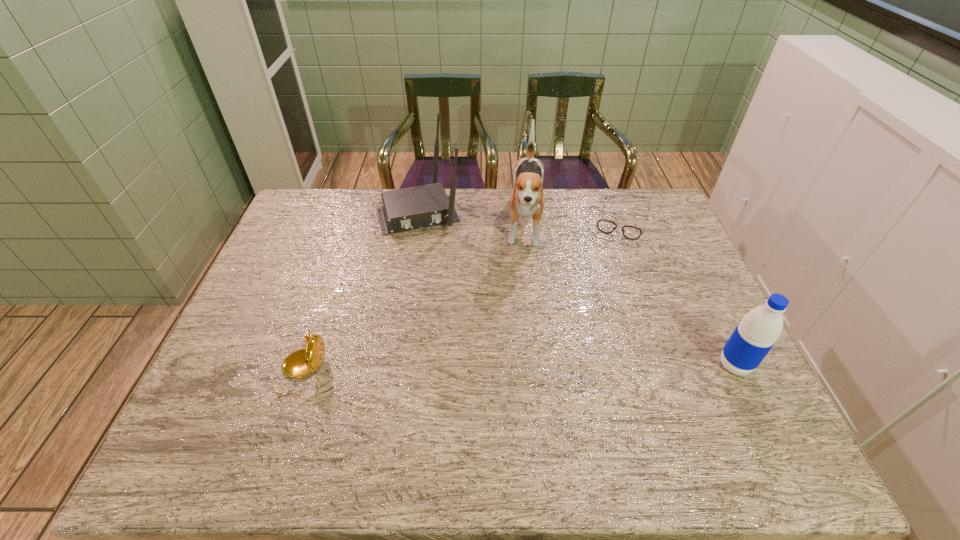
Image resolution: width=960 pixels, height=540 pixels. I want to click on blank area at the right edge, so click(x=669, y=308).

In the image, there is a desktop. Find the location of `free region at the far left corner`. free region at the far left corner is located at coordinates (340, 193).

Where is `vacant space at the near left corner of the desktop`? vacant space at the near left corner of the desktop is located at coordinates (259, 411).

Where is `vacant space that's between the router and the rightmost object`? vacant space that's between the router and the rightmost object is located at coordinates pos(577,288).

The height and width of the screenshot is (540, 960). Find the location of `vacant area that lies between the third tallest object and the sunglasses`. vacant area that lies between the third tallest object and the sunglasses is located at coordinates (679, 293).

Identify the location of vacant space that is in between the leftmost object and the third object from left to right. This screenshot has height=540, width=960. (415, 301).

The image size is (960, 540). In order to click on free area in between the rightmost object and the fourth object from left to right in this screenshot , I will do `click(679, 293)`.

This screenshot has height=540, width=960. I want to click on unoccupied position between the router and the third object from right to left, so click(472, 220).

The width and height of the screenshot is (960, 540). Find the location of `vacant area that lies between the leftmost object and the puppy`. vacant area that lies between the leftmost object and the puppy is located at coordinates (415, 301).

Where is `free spot between the sunglasses and the rightmost object`? free spot between the sunglasses and the rightmost object is located at coordinates (679, 293).